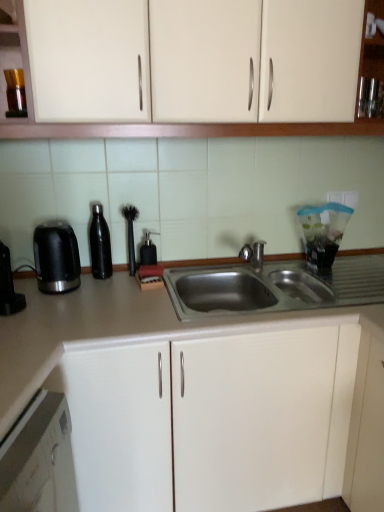
At what (x,y) coordinates should I click in order to perform the action: click on vacant space in front of black plastic coffee machine at left. Please return your answer as a coordinate pair (x, y). The width and height of the screenshot is (384, 512). Looking at the image, I should click on (16, 331).